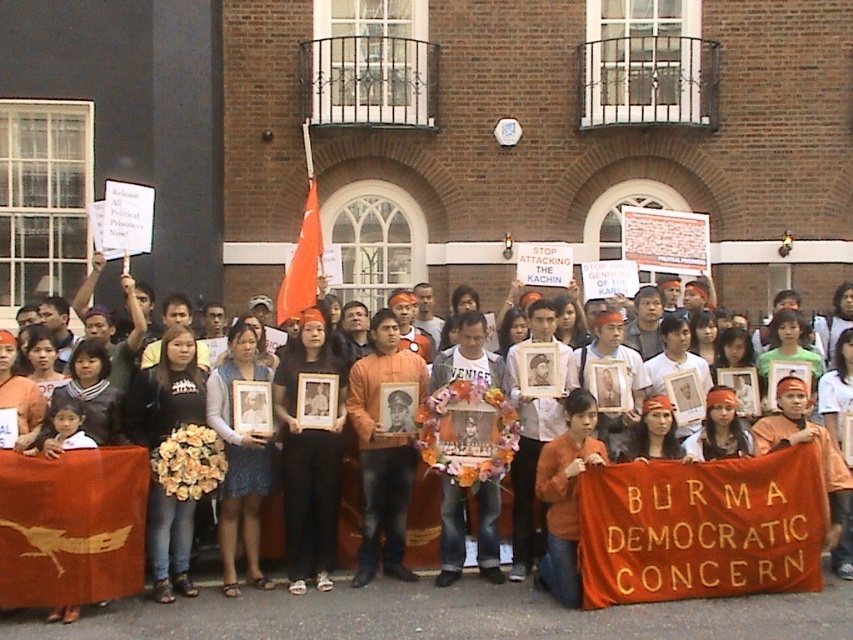
The width and height of the screenshot is (853, 640). I want to click on blue sequined dress at center, so click(x=241, y=460).

Looking at this image, between blue sequined dress at center and orange fabric flag at center, which one has more height?

blue sequined dress at center

Is point (245, 378) in front of point (300, 298)?

Yes, point (245, 378) is in front of point (300, 298).

The width and height of the screenshot is (853, 640). In order to click on blue sequined dress at center in this screenshot , I will do `click(241, 460)`.

Does orange fabric headband at center have a greater height compared to black fabric at center?

In fact, orange fabric headband at center may be shorter than black fabric at center.

Does orange fabric headband at center appear on the left side of black fabric at center?

No, orange fabric headband at center is not to the left of black fabric at center.

The height and width of the screenshot is (640, 853). Describe the element at coordinates (339, 602) in the screenshot. I see `orange fabric headband at center` at that location.

Locate an element on the screen. This screenshot has width=853, height=640. orange fabric headband at center is located at coordinates (339, 602).

Who is more forward, (323, 324) or (277, 298)?

Positioned in front is point (323, 324).

Between black fabric at center and orange fabric flag at center, which one has less height?

orange fabric flag at center is shorter.

Is point (288, 396) more distant than point (280, 300)?

No, it is in front of (280, 300).

You are a GUI agent. You are given a task and a screenshot of the screen. Output one action in this format:
    pyautogui.click(x=<x>, y=<y>)
    Task: Click on the black fabric at center
    The height and width of the screenshot is (640, 853).
    Given the screenshot: What is the action you would take?
    pyautogui.click(x=309, y=456)